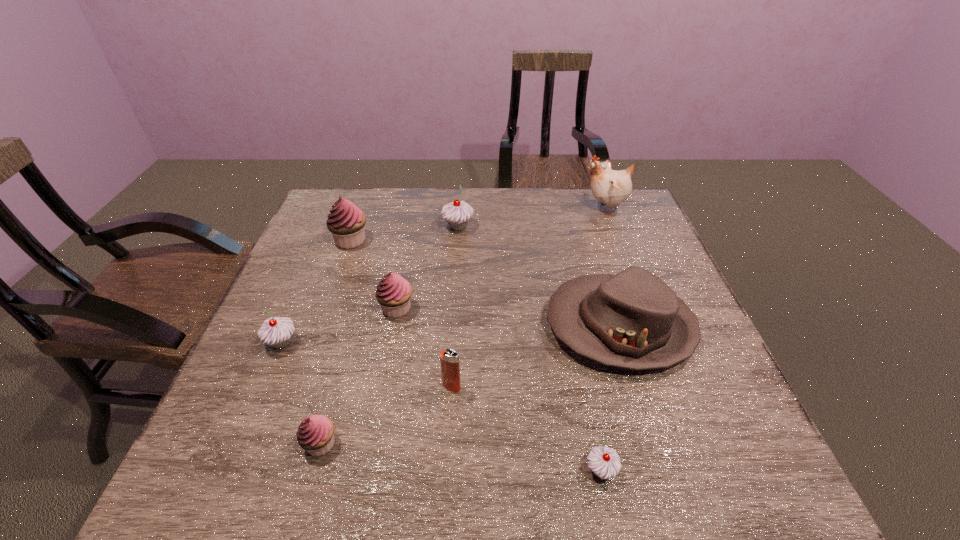
Where is `vacant space located 0.160m on the decorative side of the hat`? vacant space located 0.160m on the decorative side of the hat is located at coordinates (478, 327).

Find the location of a particular element. This screenshot has width=960, height=540. vacant region located on the decorative side of the hat is located at coordinates (473, 327).

Locate an element on the screen. vacant space located 0.230m on the back of the second nearest gray cupcake is located at coordinates click(x=315, y=266).

What are the coordinates of `free space located on the back of the second biggest pink cupcake` in the screenshot? It's located at (406, 263).

Find the location of a particular element. This screenshot has width=960, height=540. vacant space situated 0.170m on the back of the igniter is located at coordinates (455, 321).

This screenshot has height=540, width=960. In order to click on vacant region located 0.120m on the left of the smallest pink cupcake in this screenshot , I will do `click(240, 443)`.

This screenshot has height=540, width=960. In order to click on vacant space located 0.180m on the left of the rightmost cupcake in this screenshot , I will do `click(484, 470)`.

Identify the location of bird at the far edge. This screenshot has width=960, height=540. (611, 187).

Locate an element on the screen. bird that is at the right edge is located at coordinates (611, 187).

Where is `hat located in the right edge section of the desktop`? This screenshot has width=960, height=540. hat located in the right edge section of the desktop is located at coordinates (633, 320).